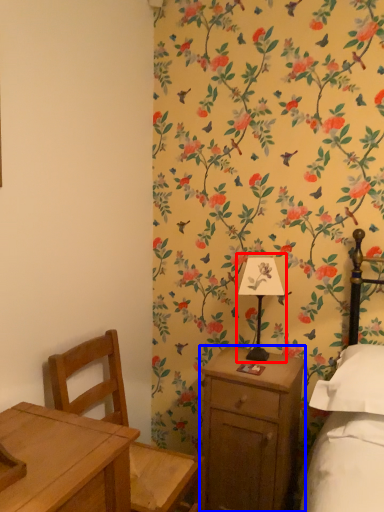
Question: Which object is further to the camera taking this photo, bedside lamp (highlighted by a red box) or nightstand (highlighted by a blue box)?

Choices:
 (A) bedside lamp
 (B) nightstand

Answer: (A)